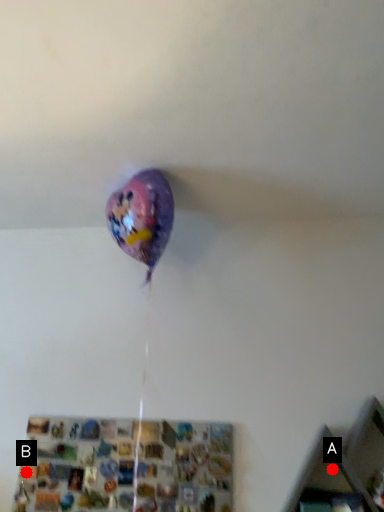
Question: Two points are circled on the image, labeled by A and B beside each circle. Which point is closer to the camera taking this photo?

Choices:
 (A) A is closer
 (B) B is closer

Answer: (A)